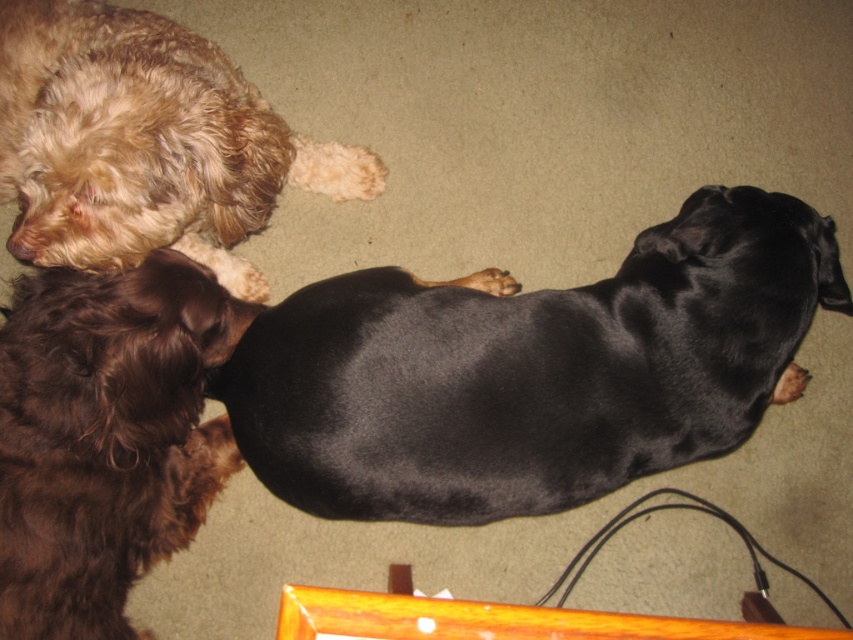
What are the coordinates of the black smooth dog at center?

The coordinates of the black smooth dog at center are at point (x=531, y=371).

Consider the image. You are a dog owner trying to locate your two dogs in the living room. You see two points marked on the floor. The first point is at position point (799, 321) and the second is at point (154, 308). If you are facing the dogs from the entrance, which point is closer to the back wall?

Point (799, 321) is behind point (154, 308), so the point at (799, 321) is closer to the back wall.